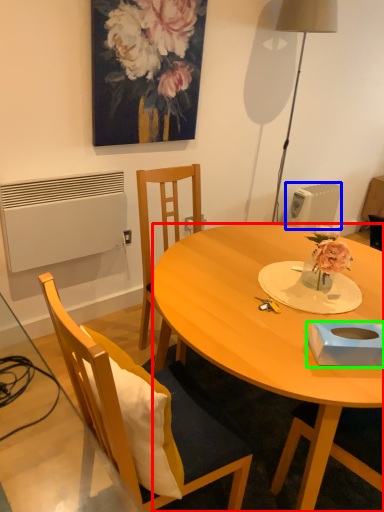
Question: Which object is positioned closest to desk (highlighted by a red box)? Select from radiator (highlighted by a blue box) and box (highlighted by a green box).

Choices:
 (A) radiator
 (B) box

Answer: (B)